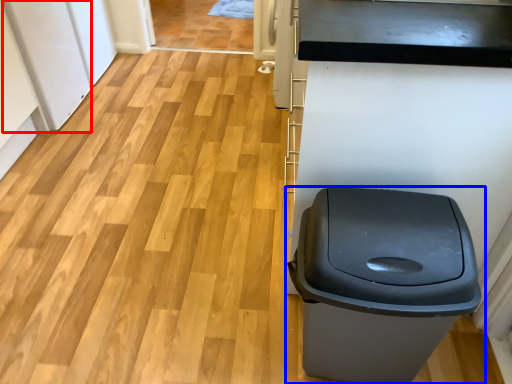
Question: Among these objects, which one is farthest to the camera, appliance (highlighted by a red box) or waste container (highlighted by a blue box)?

Choices:
 (A) appliance
 (B) waste container

Answer: (A)